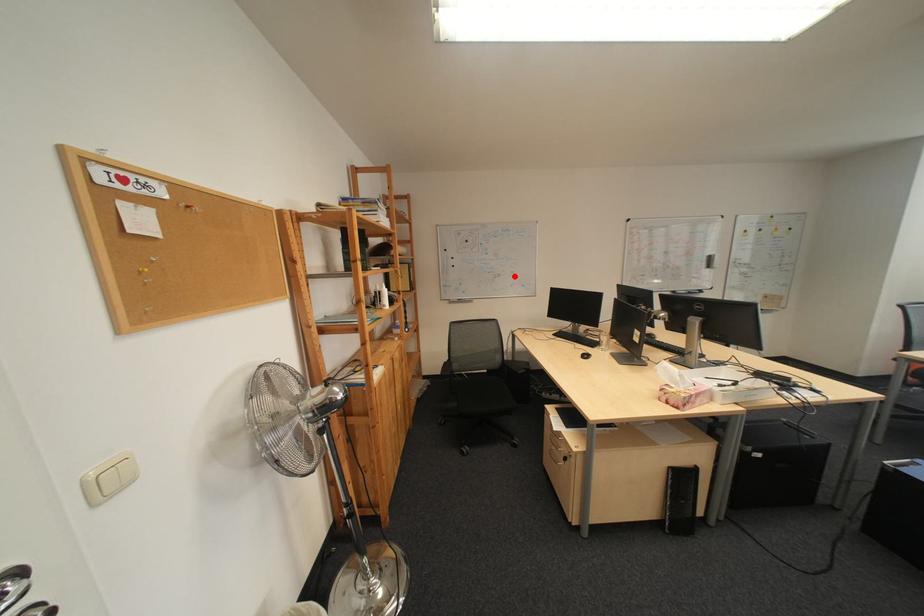
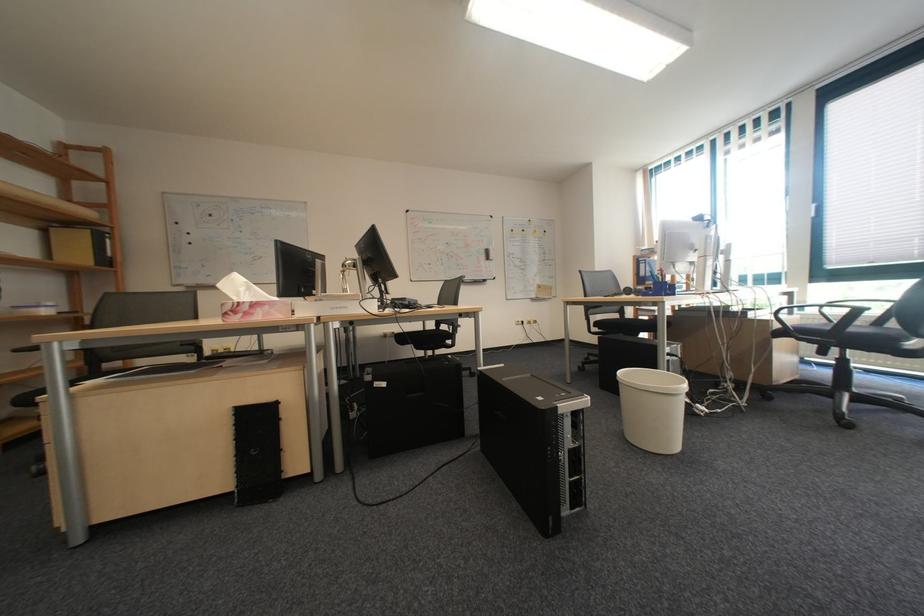
The point at the highlighted location is marked in the first image. Where is the corresponding point in the second image?

(275, 257)